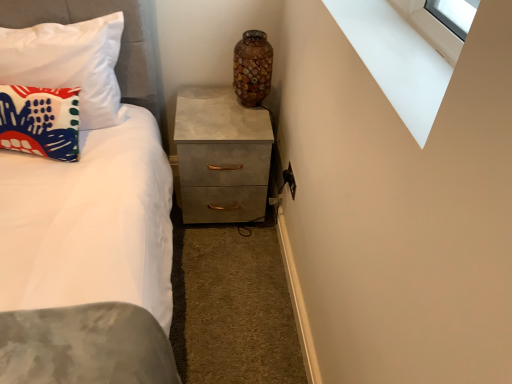
Question: Is matte fabric pillow at left, acting as the first pillow starting from the top, wider or thinner than matte concrete chest of drawers at center?

Choices:
 (A) wide
 (B) thin

Answer: (B)

Question: Visually, is matte fabric pillow at left, acting as the first pillow starting from the top, positioned to the left or to the right of matte concrete chest of drawers at center?

Choices:
 (A) right
 (B) left

Answer: (B)

Question: Based on their relative distances, which object is farther from the matte concrete chest of drawers at center?

Choices:
 (A) mosaic glass vase at upper center
 (B) white smooth window sill at upper right
 (C) matte fabric pillow at left, acting as the first pillow starting from the top
 (D) matte fabric pillow at left, which is counted as the 2th pillow, starting from the top

Answer: (B)

Question: Which object is the closest to the matte fabric pillow at left, acting as the first pillow starting from the top?

Choices:
 (A) white smooth window sill at upper right
 (B) matte fabric pillow at left, which ranks as the 1th pillow in bottom-to-top order
 (C) matte concrete chest of drawers at center
 (D) mosaic glass vase at upper center

Answer: (B)